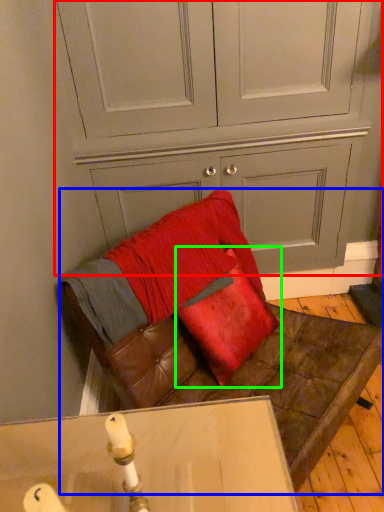
Question: Estimate the real-world distances between objects in this image. Which object is farther from dresser (highlighted by a red box), furniture (highlighted by a blue box) or throw pillow (highlighted by a green box)?

Choices:
 (A) furniture
 (B) throw pillow

Answer: (A)